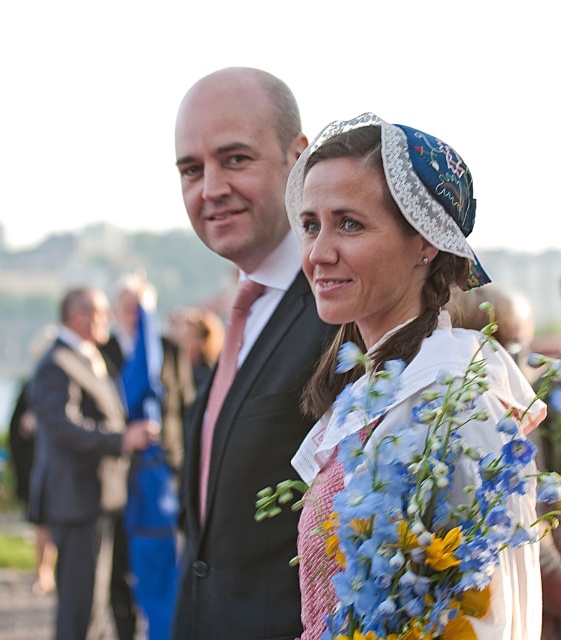
Question: Which of these objects is positioned farthest from the embroidered fabric hat at center?

Choices:
 (A) dark gray suit at left
 (B) matte black suit at center

Answer: (A)

Question: Which of the following is the farthest from the observer?

Choices:
 (A) matte black suit at center
 (B) dark gray suit at left

Answer: (B)

Question: Does matte black suit at center have a lesser width compared to dark gray suit at left?

Choices:
 (A) yes
 (B) no

Answer: (A)

Question: Which object is closer to the camera taking this photo?

Choices:
 (A) matte black suit at center
 (B) embroidered fabric hat at center
 (C) dark gray suit at left

Answer: (B)

Question: Is matte black suit at center further to camera compared to embroidered fabric hat at center?

Choices:
 (A) yes
 (B) no

Answer: (A)

Question: Is matte black suit at center behind dark gray suit at left?

Choices:
 (A) no
 (B) yes

Answer: (A)